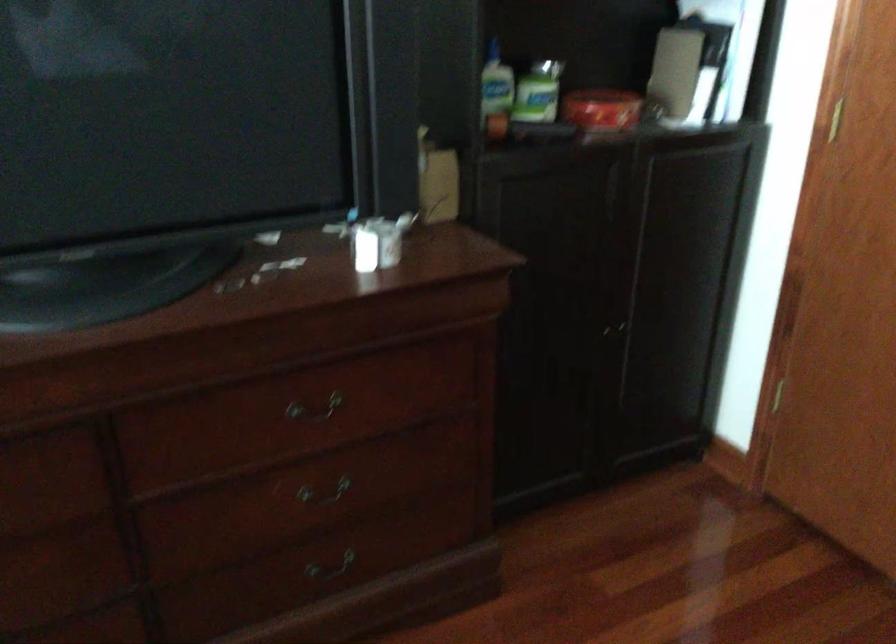
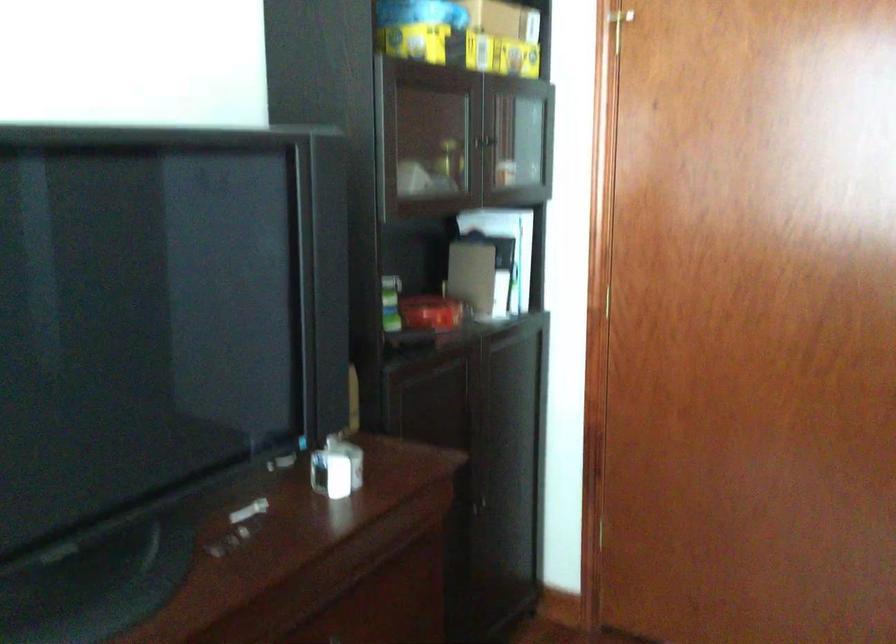
The point at (x=596, y=106) is marked in the first image. Where is the corresponding point in the second image?

(431, 313)